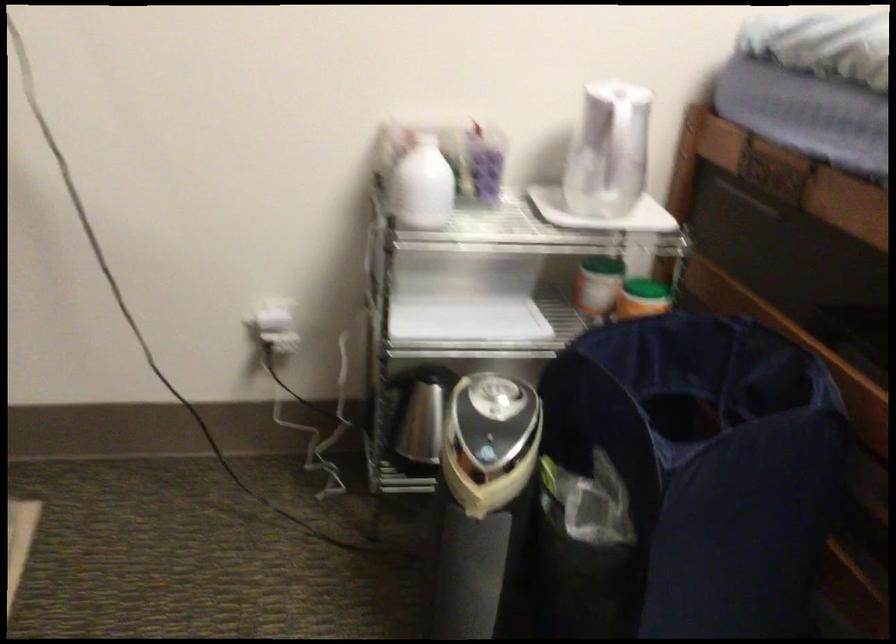
Locate an element on the screen. green jar lid is located at coordinates (602, 263).